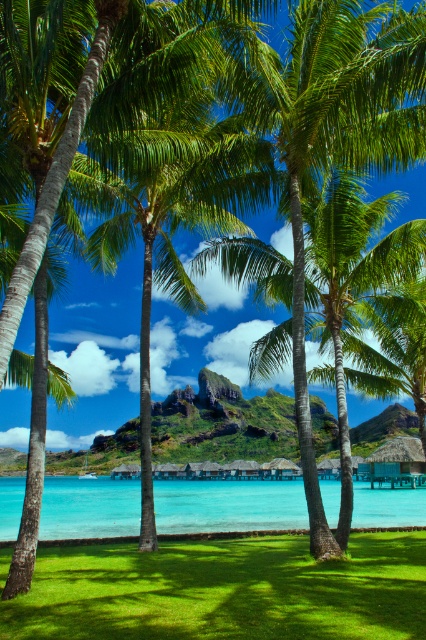
Question: Does green grass at lower left appear on the right side of clear blue water at center?

Choices:
 (A) no
 (B) yes

Answer: (B)

Question: Does green grass at lower left appear on the left side of clear blue water at center?

Choices:
 (A) no
 (B) yes

Answer: (A)

Question: Is green grass at lower left above clear blue water at center?

Choices:
 (A) no
 (B) yes

Answer: (B)

Question: Which of the following is the closest to the observer?

Choices:
 (A) clear blue water at center
 (B) green grass at lower left

Answer: (B)